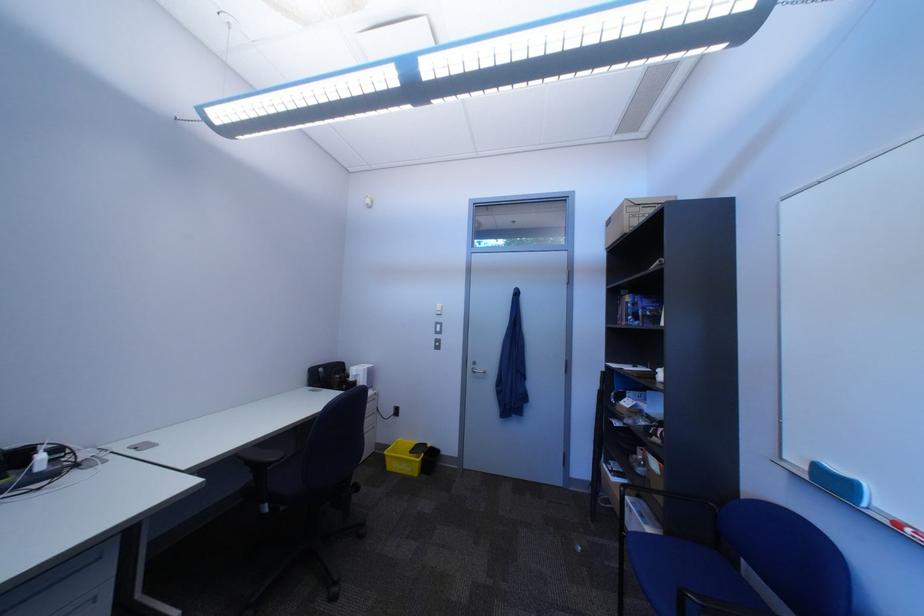
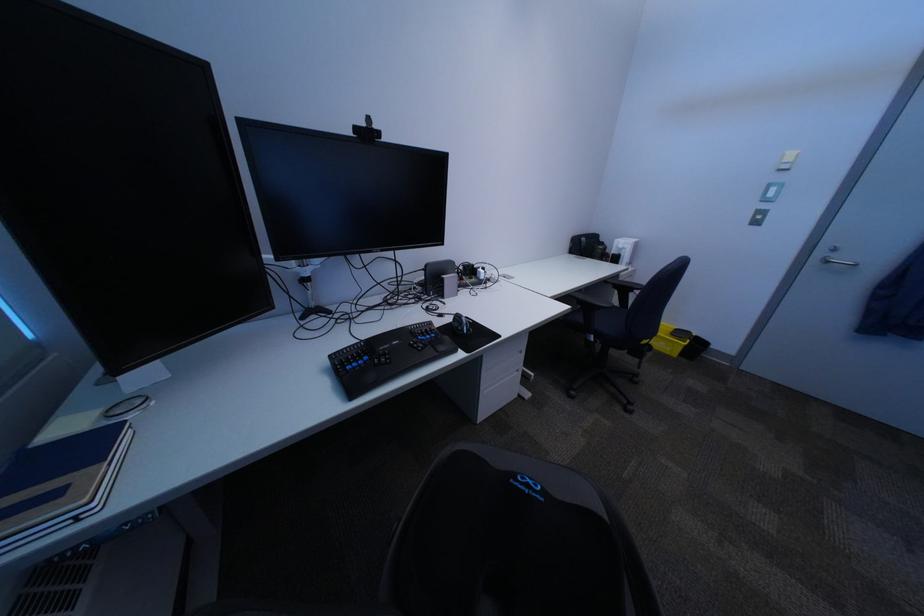
The point at (456, 312) is marked in the first image. Where is the corresponding point in the second image?

(807, 163)